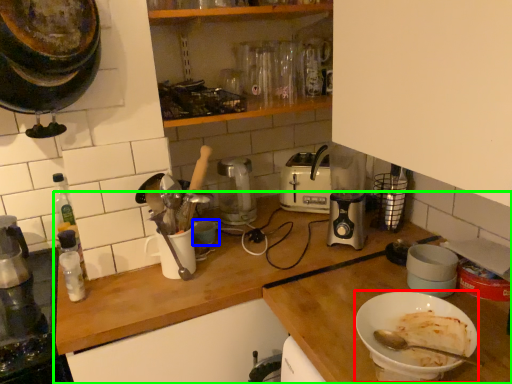
Question: Which object is positioned closest to bowl (highlighted by a red box)? Select from bowl (highlighted by a blue box) and countertop (highlighted by a green box).

Choices:
 (A) bowl
 (B) countertop

Answer: (B)